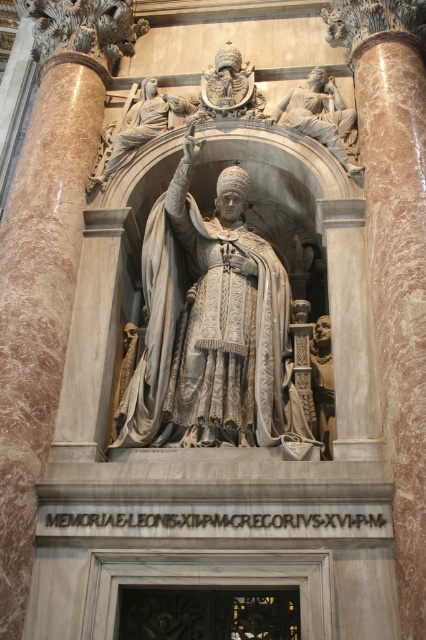
You are standing in front of the monument and want to touch both the white marble door at center and the marble statue at upper center. Which one can you reach without moving your position?

The white marble door at center is closer to the viewer than the marble statue at upper center, so you can reach the white marble door at center without moving.

Consider the image. You are standing in front of the monument and want to take a photo. You notice two points marked on the monument at coordinates point (x=347, y=138) and point (x=166, y=97). Which point will appear larger in your photo?

Point (x=347, y=138) is closer to the camera than point (x=166, y=97), so it will appear larger in the photo.